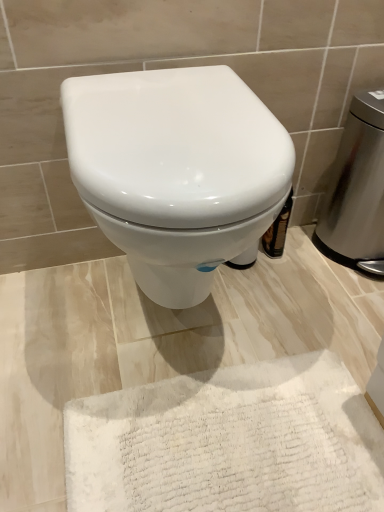
Question: Relative to stainless steel trash can at right, is white fluffy bath mat at lower center in front or behind?

Choices:
 (A) behind
 (B) front

Answer: (B)

Question: Considering the positions of white fluffy bath mat at lower center and stainless steel trash can at right in the image, is white fluffy bath mat at lower center taller or shorter than stainless steel trash can at right?

Choices:
 (A) tall
 (B) short

Answer: (B)

Question: Considering the real-world distances, which object is farthest from the white glossy toilet at center?

Choices:
 (A) stainless steel trash can at right
 (B) white fluffy bath mat at lower center

Answer: (A)

Question: Which object is positioned farthest from the stainless steel trash can at right?

Choices:
 (A) white fluffy bath mat at lower center
 (B) white glossy toilet at center

Answer: (A)